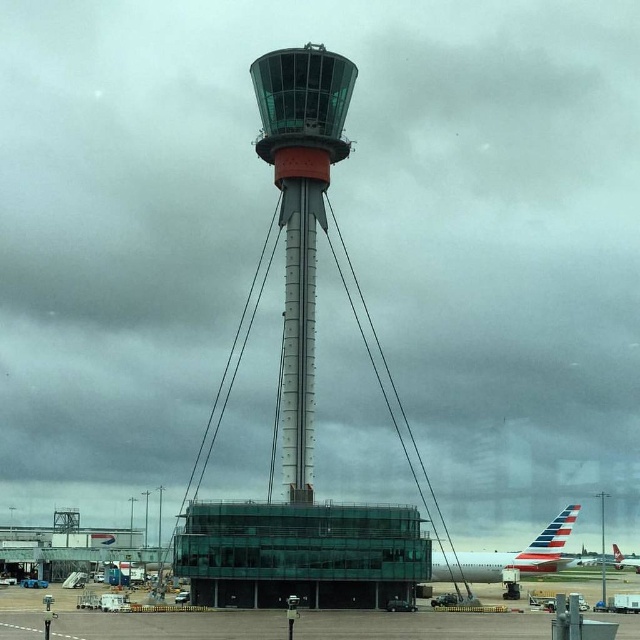
Is point (320, 211) positioned after point (369, 625)?

Yes.

At what (x,y) coordinates should I click in order to perform the action: click on glassy steel tower at center. Please return your answer as a coordinate pair (x, y). The height and width of the screenshot is (640, 640). Looking at the image, I should click on (300, 212).

Between transparent glass tower at center and smooth concrete tarmac at lower center, which one appears on the left side from the viewer's perspective?

transparent glass tower at center is more to the left.

Is point (320, 557) behind point (1, 604)?

No, it is not.

At what (x,y) coordinates should I click in order to perform the action: click on transparent glass tower at center. Please return your answer as a coordinate pair (x, y). Looking at the image, I should click on (307, 390).

Can you confirm if glassy steel tower at center is smaller than metallic silver airplane at lower right?

No, glassy steel tower at center is not smaller than metallic silver airplane at lower right.

Does point (284, 93) come in front of point (614, 552)?

Yes, it is.

Locate an element on the screen. The height and width of the screenshot is (640, 640). glassy steel tower at center is located at coordinates (300, 212).